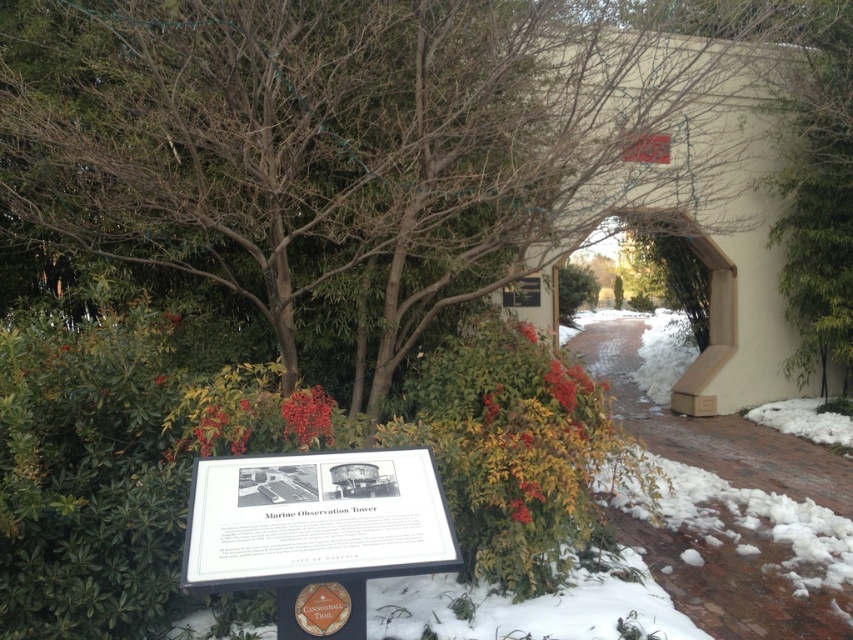
Question: Among these objects, which one is nearest to the camera?

Choices:
 (A) brick at center
 (B) white plastic sign at center
 (C) brown leafy tree at center

Answer: (B)

Question: Estimate the real-world distances between objects in this image. Which object is farther from the brick at center?

Choices:
 (A) brown leafy tree at center
 (B) white plastic sign at center

Answer: (A)

Question: Can you confirm if brown leafy tree at center is positioned to the left of white plastic sign at center?

Choices:
 (A) yes
 (B) no

Answer: (A)

Question: Is brick at center to the right of white plastic sign at center from the viewer's perspective?

Choices:
 (A) yes
 (B) no

Answer: (A)

Question: Which of the following is the farthest from the observer?

Choices:
 (A) brick at center
 (B) brown leafy tree at center
 (C) white plastic sign at center

Answer: (B)

Question: Is brown leafy tree at center further to the viewer compared to brick at center?

Choices:
 (A) no
 (B) yes

Answer: (B)